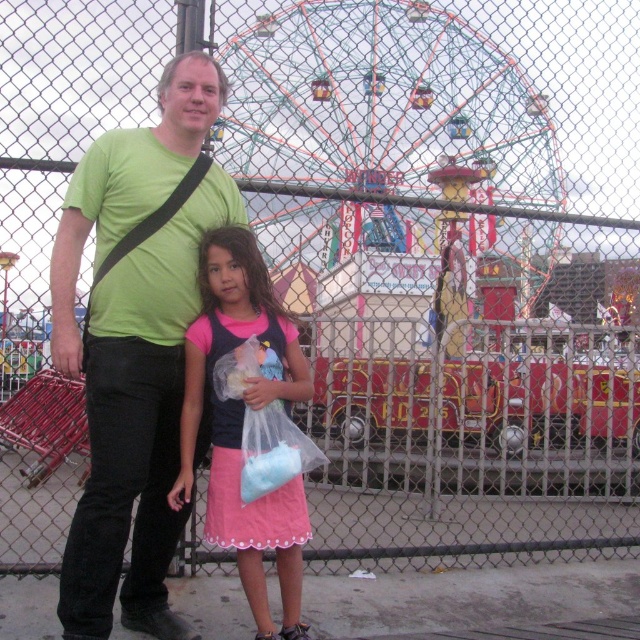
Is green matte t-shirt at center taller than pink satin dress at center?

Yes.

Who is shorter, green matte t-shirt at center or pink satin dress at center?

With less height is pink satin dress at center.

Which is in front, point (163, 557) or point (188, 444)?

Point (163, 557)

Locate an element on the screen. Image resolution: width=640 pixels, height=640 pixels. green matte t-shirt at center is located at coordinates (134, 346).